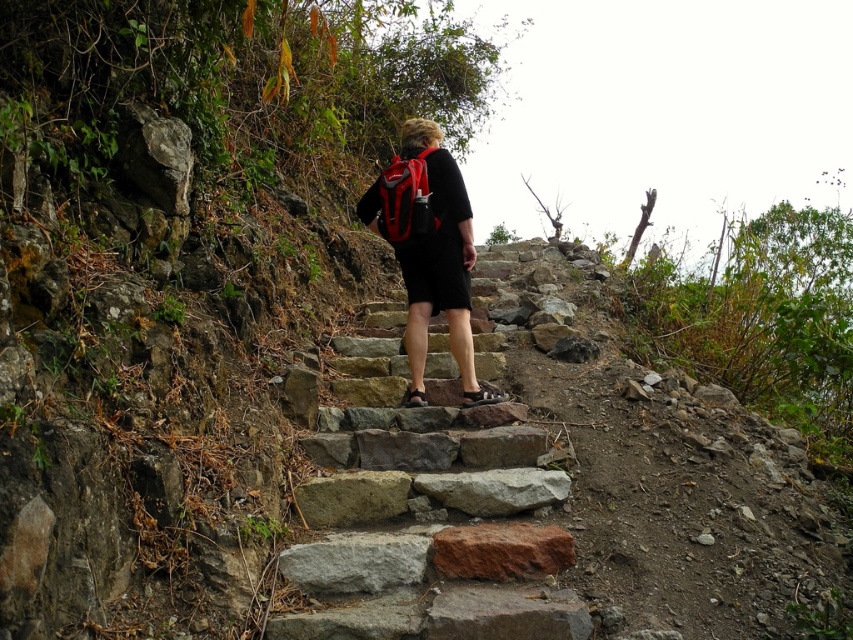
Question: Observing the image, what is the correct spatial positioning of gray stone stairs at center in reference to matte black backpack at center?

Choices:
 (A) below
 (B) above

Answer: (A)

Question: Does gray stone stairs at center have a greater width compared to matte black backpack at center?

Choices:
 (A) yes
 (B) no

Answer: (A)

Question: Which object appears closest to the camera in this image?

Choices:
 (A) gray stone stairs at center
 (B) matte black backpack at center

Answer: (A)

Question: Is gray stone stairs at center positioned behind matte black backpack at center?

Choices:
 (A) yes
 (B) no

Answer: (B)

Question: Which point appears closest to the camera in this image?

Choices:
 (A) (425, 285)
 (B) (457, 488)

Answer: (B)

Question: Among these points, which one is farthest from the camera?

Choices:
 (A) (412, 344)
 (B) (451, 444)

Answer: (A)